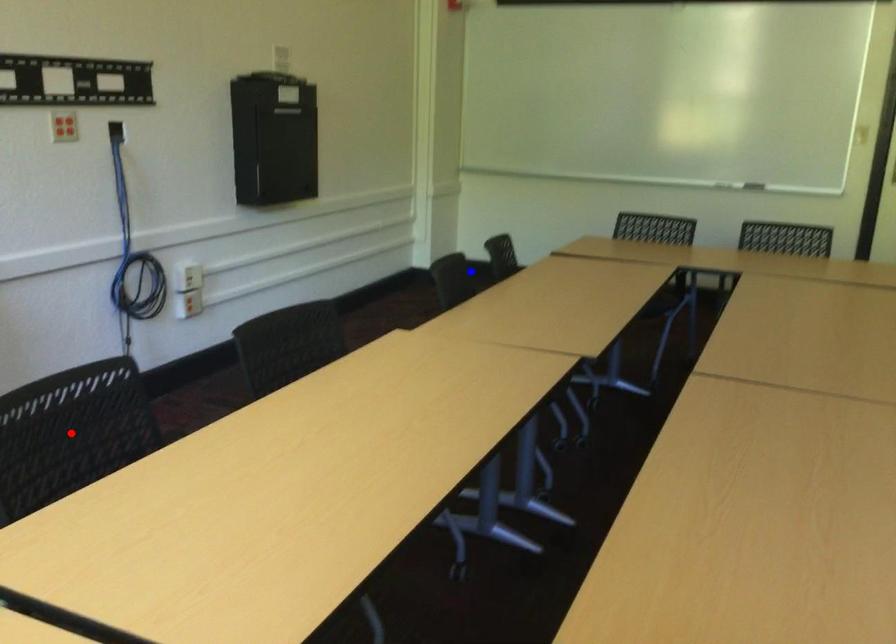
Question: In the image, two points are highlighted. Which point is nearer to the camera? Reply with the corresponding letter.

Choices:
 (A) blue point
 (B) red point

Answer: (B)